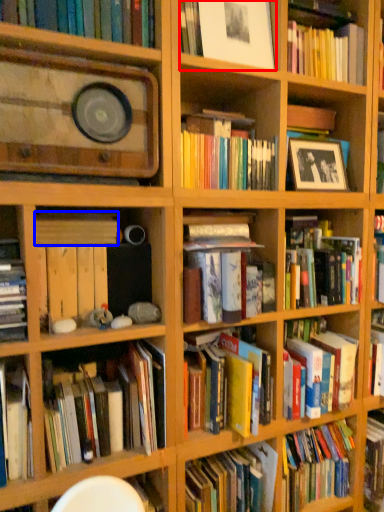
Question: Which object is further to the camera taking this photo, book (highlighted by a red box) or book (highlighted by a blue box)?

Choices:
 (A) book
 (B) book

Answer: (A)